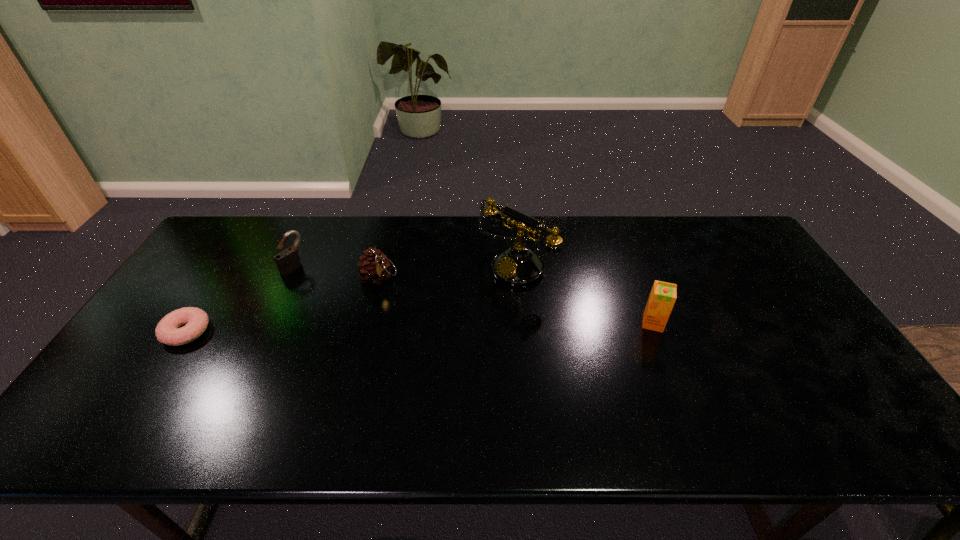
Identify the location of free space on the desktop that is between the shortest object and the rightmost object and is positioned with the keyhole on the front of the padlock. The height and width of the screenshot is (540, 960). (394, 328).

I want to click on vacant space on the desktop that is between the shortest object and the orange juice and is positioned with a leaf charm attached to the third object from left to right, so click(x=422, y=327).

Where is `free spot on the desktop that is between the doughnut and the second tallest object and is positioned on the dial of the telephone`? The width and height of the screenshot is (960, 540). free spot on the desktop that is between the doughnut and the second tallest object and is positioned on the dial of the telephone is located at coordinates (440, 327).